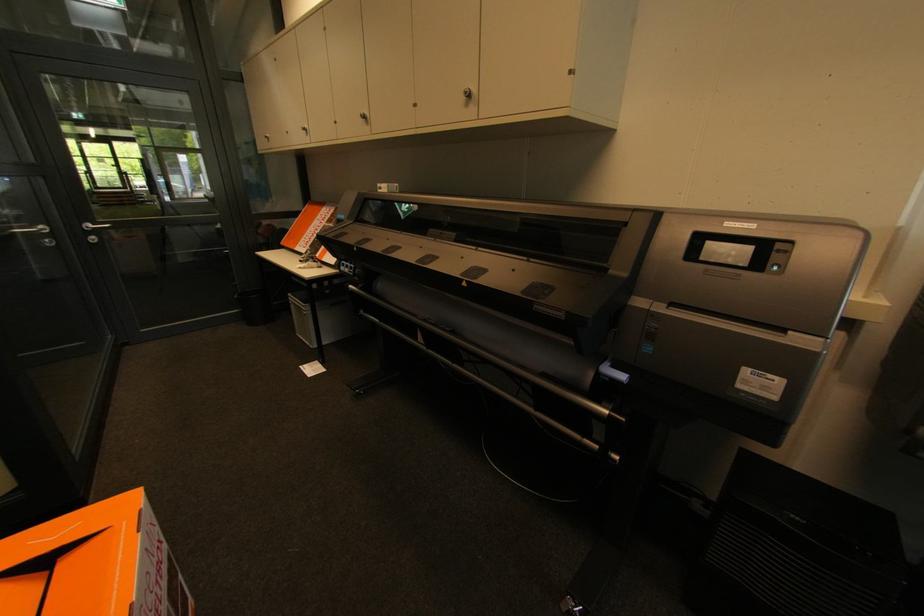
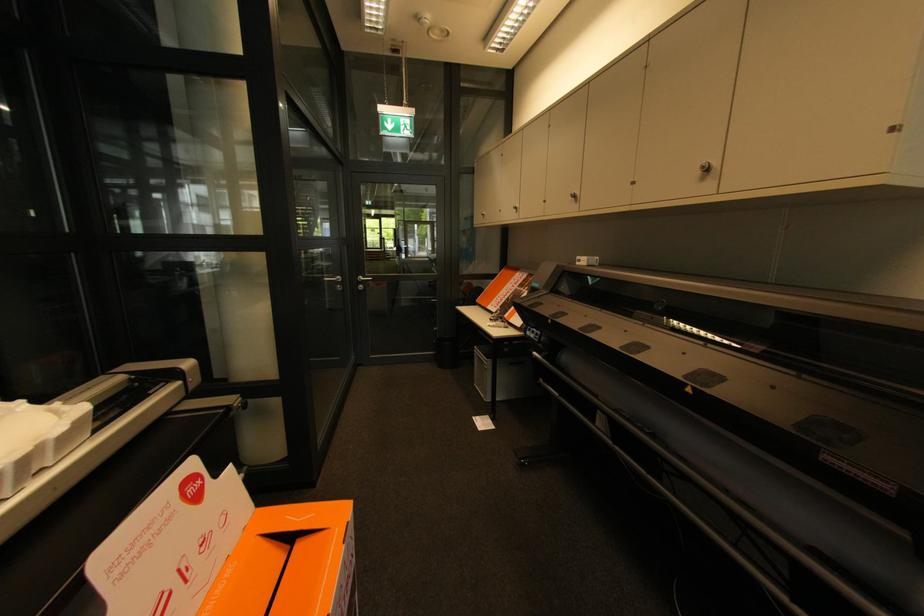
Find the pixel in the second image that matches (365,116) in the first image.

(576, 196)